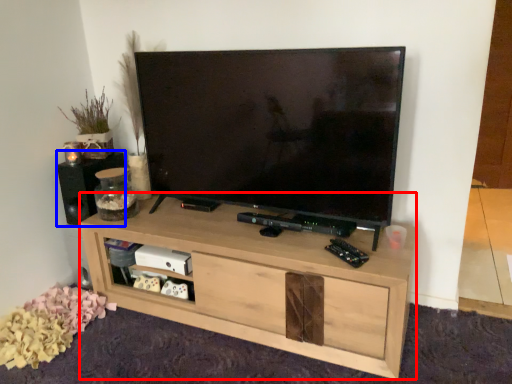
Question: Which object is further to the camera taking this photo, shelf (highlighted by a red box) or speaker (highlighted by a blue box)?

Choices:
 (A) shelf
 (B) speaker

Answer: (B)